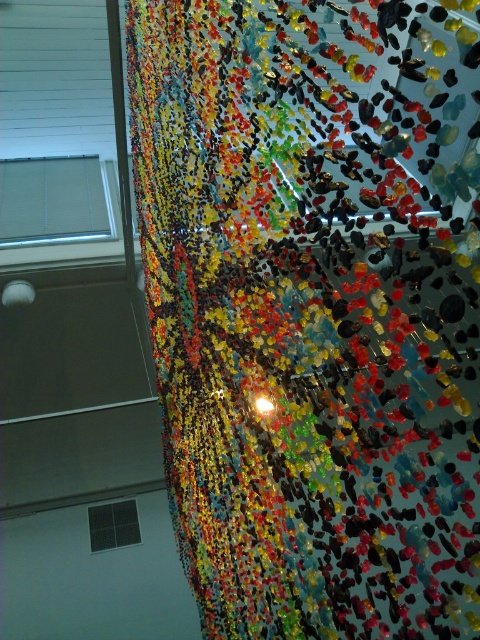
Is point (288, 547) behind point (90, 216)?

That is False.

Is translucent glass confetti at upper center further to camera compared to white blinds at upper left?

No, translucent glass confetti at upper center is in front of white blinds at upper left.

Who is more forward, [196,76] or [105,205]?

Point [196,76] is in front.

This screenshot has height=640, width=480. Identify the location of translucent glass confetti at upper center. (307, 323).

How much distance is there between white blinds at upper left and black glass window at lower left?

white blinds at upper left and black glass window at lower left are 2.93 meters apart from each other.

The width and height of the screenshot is (480, 640). I want to click on white blinds at upper left, so click(x=54, y=200).

Is translucent glass confetti at upper center shorter than black glass window at lower left?

In fact, translucent glass confetti at upper center may be taller than black glass window at lower left.

Can you confirm if translucent glass confetti at upper center is positioned to the right of black glass window at lower left?

Correct, you'll find translucent glass confetti at upper center to the right of black glass window at lower left.

Is point (380, 368) more distant than point (97, 528)?

No, (380, 368) is in front of (97, 528).

You are a GUI agent. You are given a task and a screenshot of the screen. Output one action in this format:
    pyautogui.click(x=<x>, y=<y>)
    Task: Click on the translucent glass confetti at upper center
    
    Given the screenshot: What is the action you would take?
    pyautogui.click(x=307, y=323)